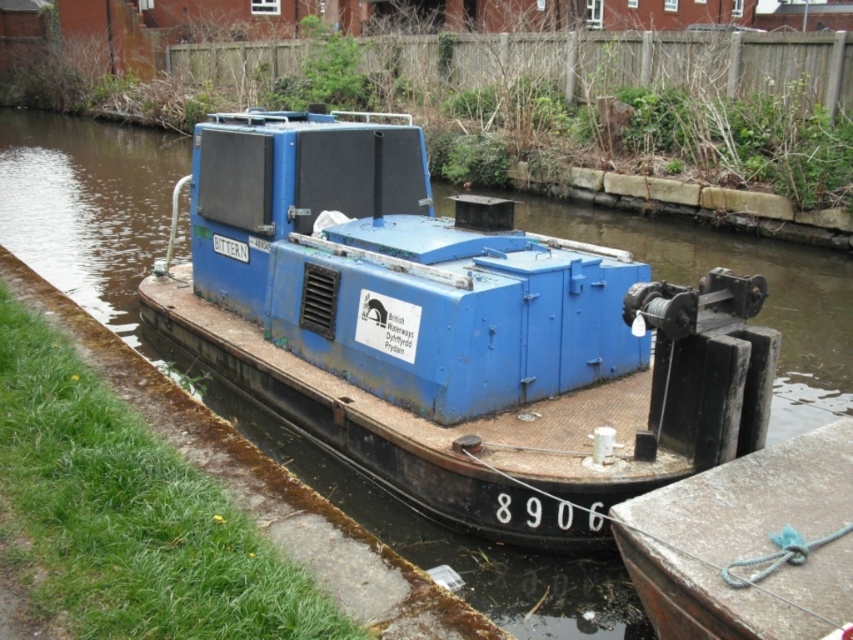
Between point (711, 451) and point (769, 538), which one is positioned in front?

Point (769, 538)

Is point (509, 506) behind point (799, 586)?

That is True.

The height and width of the screenshot is (640, 853). In order to click on blue matte boat at center in this screenshot , I will do (451, 332).